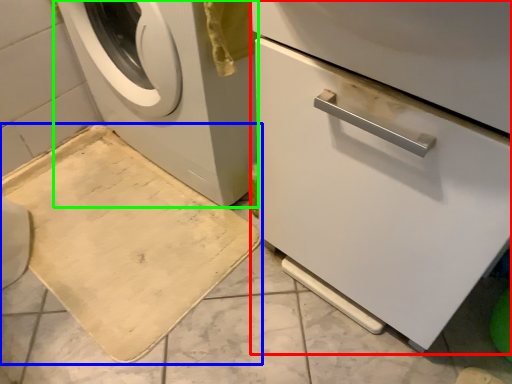
Question: Which is farther away from machine (highlighted by a red box)? bath mat (highlighted by a blue box) or washing machine (highlighted by a green box)?

Choices:
 (A) bath mat
 (B) washing machine

Answer: (A)